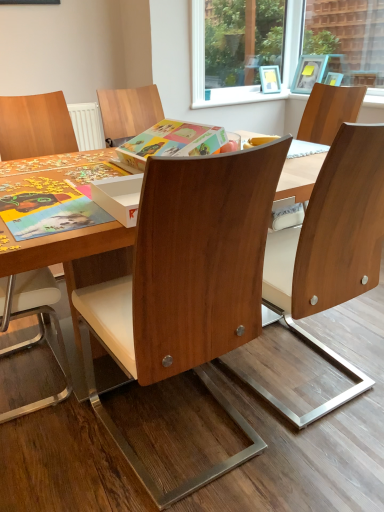
The width and height of the screenshot is (384, 512). I want to click on free spot in front of wooden chair at center, the first chair viewed from the right, so click(x=314, y=452).